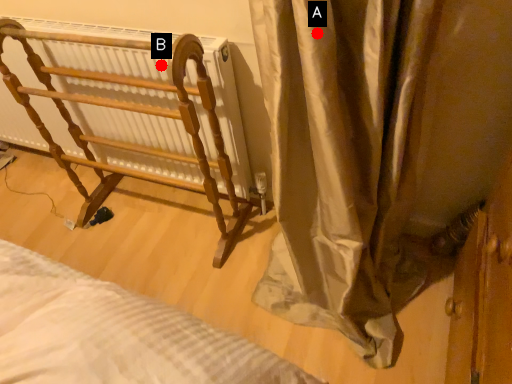
Question: Two points are circled on the image, labeled by A and B beside each circle. Which point is further to the camera?

Choices:
 (A) A is further
 (B) B is further

Answer: (B)